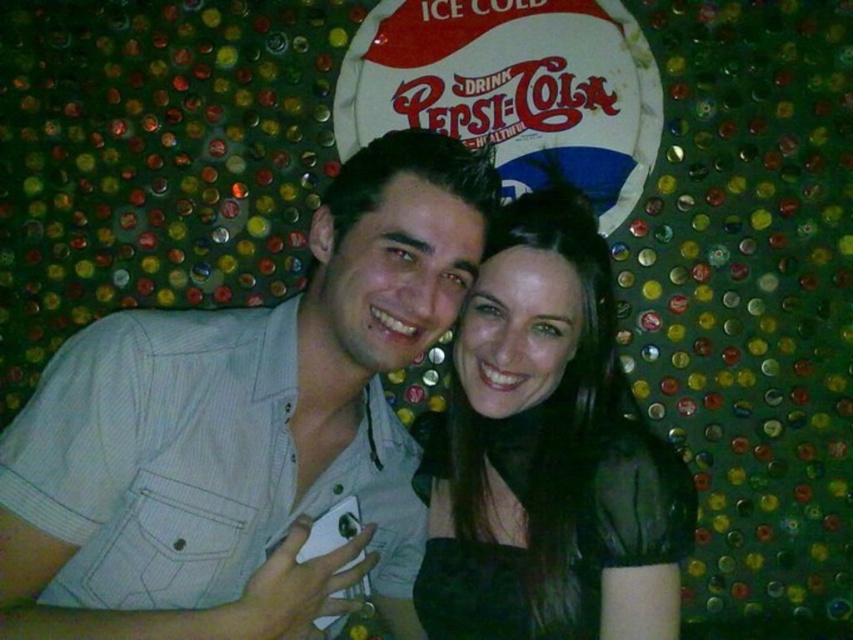
Describe the element at coordinates (245, 429) in the screenshot. I see `light gray striped shirt at center` at that location.

Does point (183, 529) lie in front of point (531, 241)?

Yes.

Is point (126, 381) positioned after point (689, 524)?

No, it is in front of (689, 524).

Where is `light gray striped shirt at center`? This screenshot has height=640, width=853. light gray striped shirt at center is located at coordinates (245, 429).